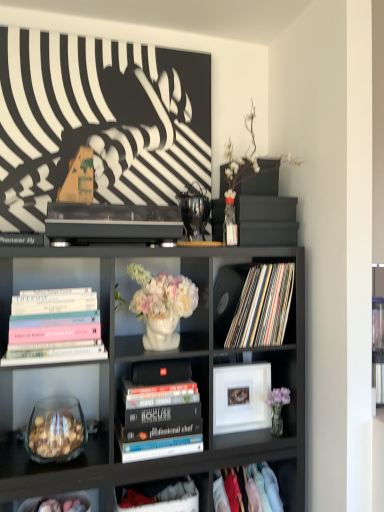
Question: Is matte vinyl records at center, positioned as the 3th book in left-to-right order, wider than cloth at lower right, the second shelf positioned from the top?

Choices:
 (A) no
 (B) yes

Answer: (A)

Question: Considering the relative sizes of matte vinyl records at center, positioned as the 3th book in left-to-right order, and cloth at lower right, which appears as the first shelf when viewed from the right, in the image provided, is matte vinyl records at center, positioned as the 3th book in left-to-right order, bigger than cloth at lower right, which appears as the first shelf when viewed from the right,?

Choices:
 (A) no
 (B) yes

Answer: (B)

Question: Can you confirm if matte vinyl records at center, the third book from the bottom, is smaller than cloth at lower right, the second shelf positioned from the top?

Choices:
 (A) yes
 (B) no

Answer: (B)

Question: Is matte vinyl records at center, placed as the 1th book when sorted from right to left, closer to the viewer compared to cloth at lower right, which appears as the first shelf when viewed from the right?

Choices:
 (A) yes
 (B) no

Answer: (B)

Question: Considering the relative sizes of matte vinyl records at center, which is the first book from top to bottom, and cloth at lower right, the second shelf positioned from the top, in the image provided, is matte vinyl records at center, which is the first book from top to bottom, taller than cloth at lower right, the second shelf positioned from the top,?

Choices:
 (A) yes
 (B) no

Answer: (A)

Question: Visually, is matte black bookcase at center positioned to the left or to the right of pastel hardcover books at left, the third book when ordered from right to left?

Choices:
 (A) left
 (B) right

Answer: (B)

Question: Is matte black bookcase at center spatially inside pastel hardcover books at left, the 2th book when ordered from top to bottom, or outside of it?

Choices:
 (A) inside
 (B) outside

Answer: (B)

Question: From the image's perspective, is matte black bookcase at center above or below pastel hardcover books at left, which appears as the first book when viewed from the left?

Choices:
 (A) below
 (B) above

Answer: (A)

Question: From a real-world perspective, is matte black bookcase at center positioned above or below pastel hardcover books at left, the 2th book when ordered from top to bottom?

Choices:
 (A) above
 (B) below

Answer: (B)

Question: Considering the positions of point (294, 492) and point (29, 289), is point (294, 492) closer or farther from the camera than point (29, 289)?

Choices:
 (A) closer
 (B) farther

Answer: (B)

Question: Relative to pastel hardcover books at left, which appears as the first book when viewed from the left, is cloth at lower right, which appears as the first shelf when viewed from the right, in front or behind?

Choices:
 (A) behind
 (B) front

Answer: (A)

Question: Do you think cloth at lower right, marked as the 2th shelf in a left-to-right arrangement, is within pastel hardcover books at left, the third book when ordered from right to left, or outside of it?

Choices:
 (A) outside
 (B) inside

Answer: (A)

Question: From a real-world perspective, is cloth at lower right, the second shelf positioned from the top, above or below pastel hardcover books at left, the 2th book when ordered from top to bottom?

Choices:
 (A) below
 (B) above

Answer: (A)

Question: Would you say hardcover books at center, arranged as the 2th book when viewed from the left, is to the left or to the right of black matte speaker at center in the picture?

Choices:
 (A) left
 (B) right

Answer: (A)

Question: From a real-world perspective, relative to black matte speaker at center, is hardcover books at center, arranged as the 2th book when viewed from the left, vertically above or below?

Choices:
 (A) above
 (B) below

Answer: (B)